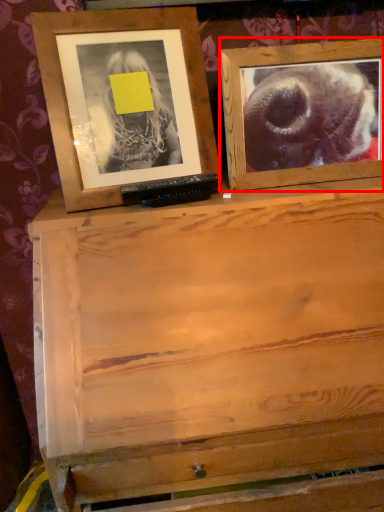
Question: Considering the relative positions of picture frame (annotated by the red box) and picture frame in the image provided, where is picture frame (annotated by the red box) located with respect to the staircase?

Choices:
 (A) right
 (B) left

Answer: (A)